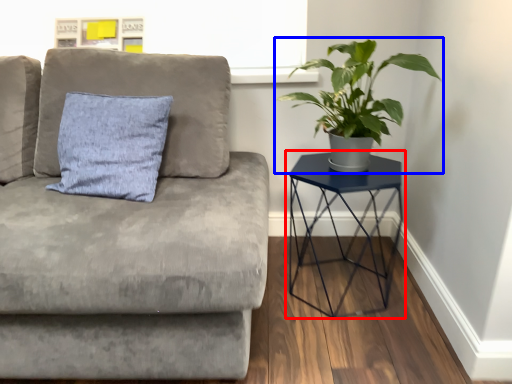
Question: Which of the following is the farthest to the observer, table (highlighted by a red box) or houseplant (highlighted by a blue box)?

Choices:
 (A) table
 (B) houseplant

Answer: (A)